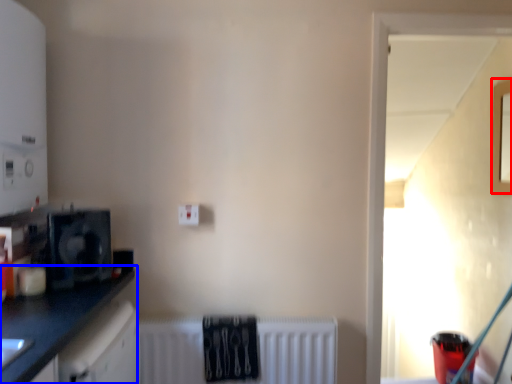
Question: Among these objects, which one is farthest to the camera, window (highlighted by a red box) or countertop (highlighted by a blue box)?

Choices:
 (A) window
 (B) countertop

Answer: (A)